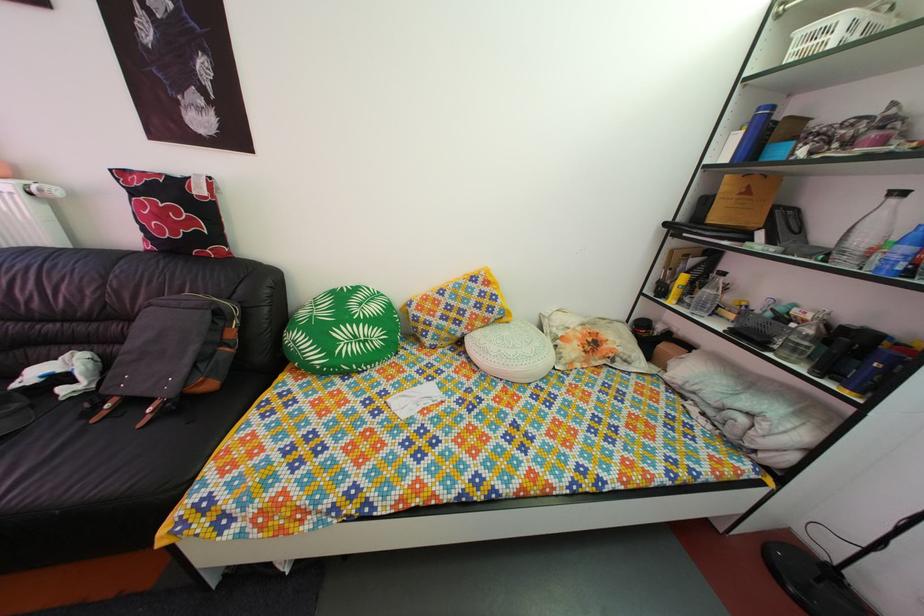
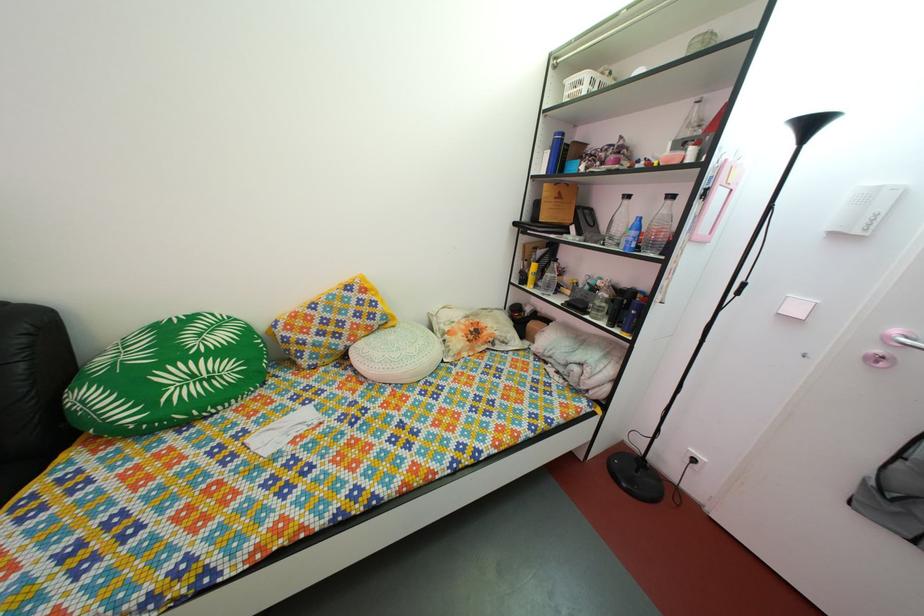
Find the pixel in the second image that matches pixel 274 325 in the first image.

(31, 386)